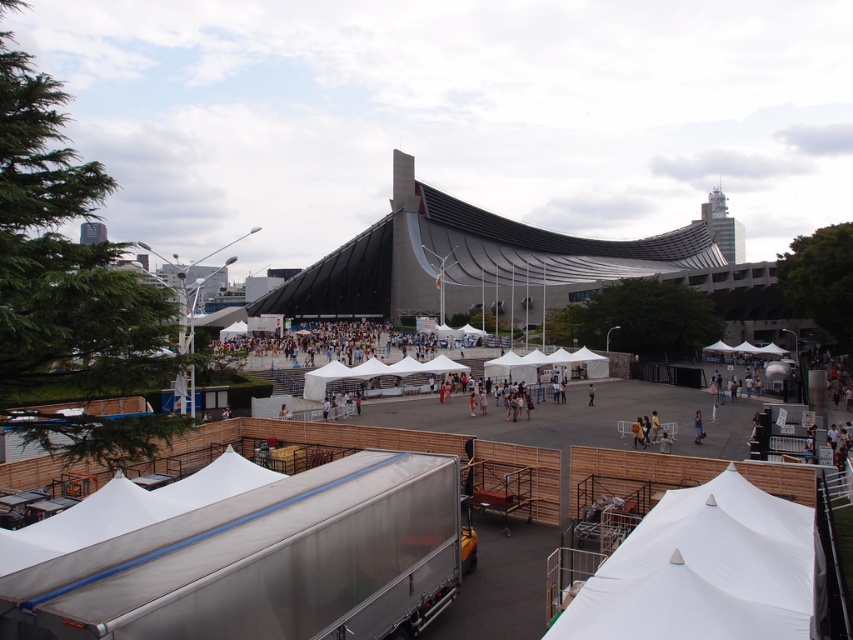
You are a GUI agent. You are given a task and a screenshot of the screen. Output one action in this format:
    pyautogui.click(x=<x>, y=<y>)
    Task: Click on the white fabric tent at lower right
    The width and height of the screenshot is (853, 640).
    Given the screenshot: What is the action you would take?
    705,570

Is point (810, 630) positioned behind point (693, 419)?

No, it is in front of (693, 419).

Is point (775, 547) farther from camera compared to point (703, 436)?

No, (775, 547) is in front of (703, 436).

Find the location of a particular element. Image resolution: width=853 pixels, height=640 pixels. white fabric tent at lower right is located at coordinates (705, 570).

Does white fabric tent at center come in front of light blue fabric shirt at center?

No.

Can you confirm if white fabric tent at center is positioned below light blue fabric shirt at center?

Actually, white fabric tent at center is above light blue fabric shirt at center.

This screenshot has width=853, height=640. In order to click on white fabric tent at center in this screenshot , I will do `click(351, 342)`.

Can you confirm if white fabric tent at lower right is taller than white fabric tent at center?

Incorrect, white fabric tent at lower right's height is not larger of white fabric tent at center's.

Can you confirm if white fabric tent at lower right is shorter than white fabric tent at center?

Yes.

Which is behind, point (746, 616) or point (364, 326)?

The point (364, 326) is more distant.

The width and height of the screenshot is (853, 640). In order to click on white fabric tent at lower right in this screenshot , I will do `click(705, 570)`.